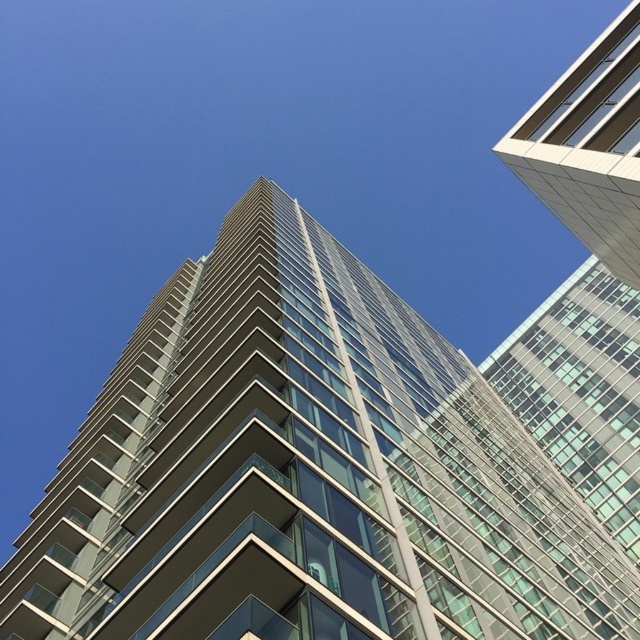
Between glassy steel building at center and white glass building at upper right, which one appears on the left side from the viewer's perspective?

From the viewer's perspective, glassy steel building at center appears more on the left side.

Between point (573, 324) and point (593, 49), which one is positioned in front?

Positioned in front is point (593, 49).

This screenshot has width=640, height=640. In order to click on glassy steel building at center in this screenshot , I will do 340,464.